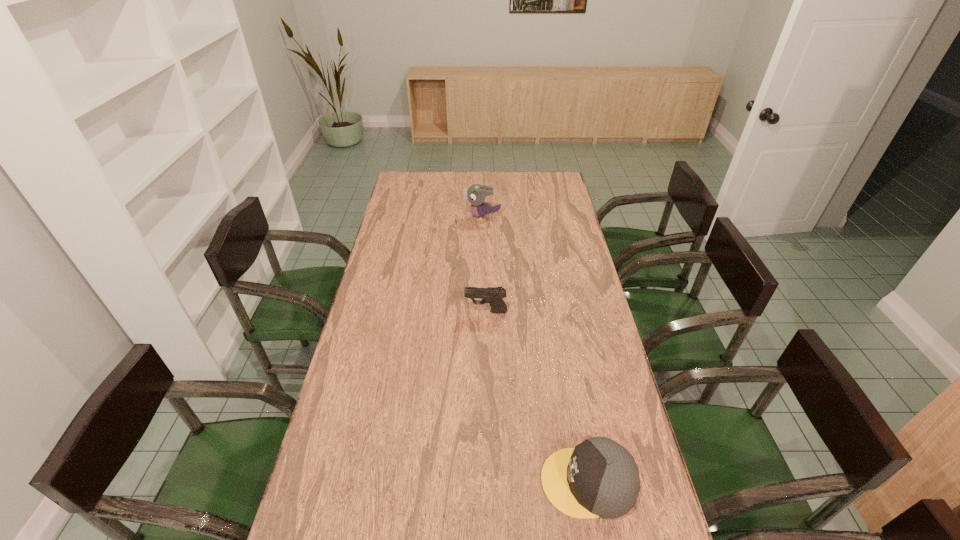
The width and height of the screenshot is (960, 540). I want to click on the tallest object, so click(476, 194).

You are a GUI agent. You are given a task and a screenshot of the screen. Output one action in this format:
    pyautogui.click(x=<x>, y=<y>)
    Task: Click on the farthest object
    Image resolution: width=960 pixels, height=540 pixels.
    Given the screenshot: What is the action you would take?
    pyautogui.click(x=476, y=194)

Image resolution: width=960 pixels, height=540 pixels. I want to click on pistol, so pyautogui.click(x=494, y=295).

Where is `the rightmost object`? The width and height of the screenshot is (960, 540). the rightmost object is located at coordinates (598, 478).

What are the coordinates of `the nearest object` in the screenshot? It's located at (598, 478).

Image resolution: width=960 pixels, height=540 pixels. Find the location of `free space located at the beak of the bird`. free space located at the beak of the bird is located at coordinates (446, 217).

I want to click on free space located at the beak of the bird, so click(x=414, y=217).

Find the location of `free space located at the beak of the bird`. free space located at the beak of the bird is located at coordinates (396, 217).

Find the location of a particular element. The image size is (960, 540). free spot located 0.070m at the barrel of the pistol is located at coordinates 445,312.

I want to click on vacant region located 0.200m at the barrel of the pistol, so click(x=409, y=312).